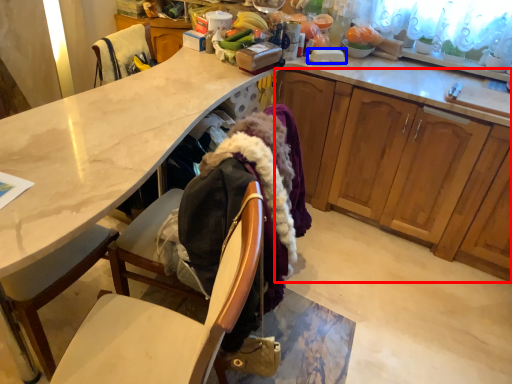
Question: Which of the following is the closest to the observer, cabinetry (highlighted by a red box) or plate (highlighted by a blue box)?

Choices:
 (A) cabinetry
 (B) plate

Answer: (A)